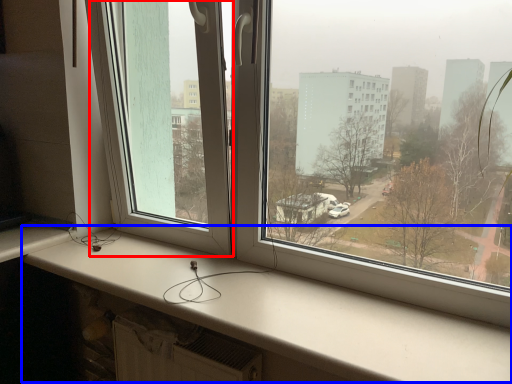
Question: Among these objects, which one is farthest to the camera, window screen (highlighted by a red box) or window sill (highlighted by a blue box)?

Choices:
 (A) window screen
 (B) window sill

Answer: (A)